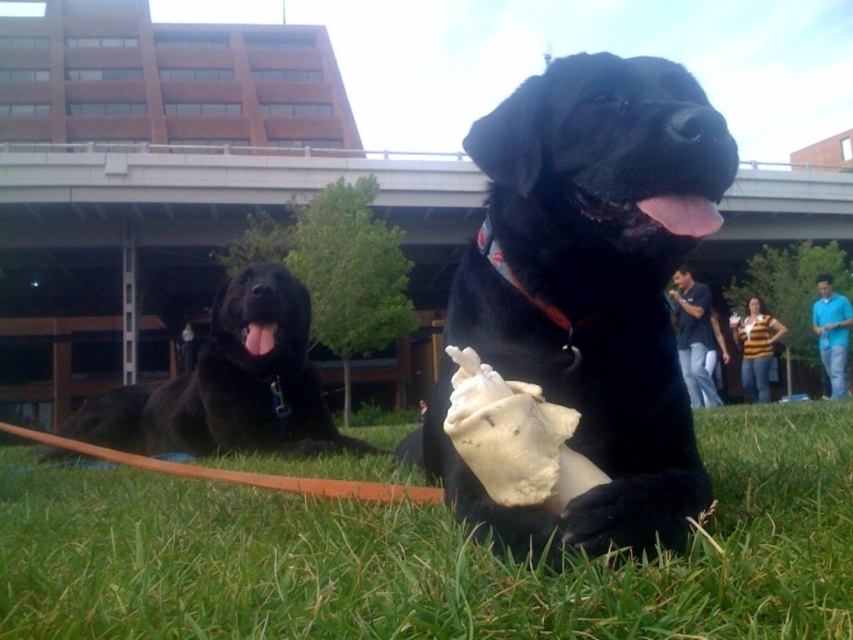
Question: Which point appears closest to the camera in this image?

Choices:
 (A) (665, 612)
 (B) (322, 416)

Answer: (A)

Question: Does green grass at lower center appear under black matte dog at center?

Choices:
 (A) yes
 (B) no

Answer: (A)

Question: Is green grass at lower center in front of black matte dog at left?

Choices:
 (A) no
 (B) yes

Answer: (B)

Question: Which is nearer to the black matte dog at left?

Choices:
 (A) green grass at lower center
 (B) black matte dog at center

Answer: (A)

Question: Which point is farther to the camera?

Choices:
 (A) black matte dog at center
 (B) black matte dog at left
 (C) green grass at lower center

Answer: (B)

Question: Observing the image, what is the correct spatial positioning of green grass at lower center in reference to black matte dog at center?

Choices:
 (A) below
 (B) above

Answer: (A)